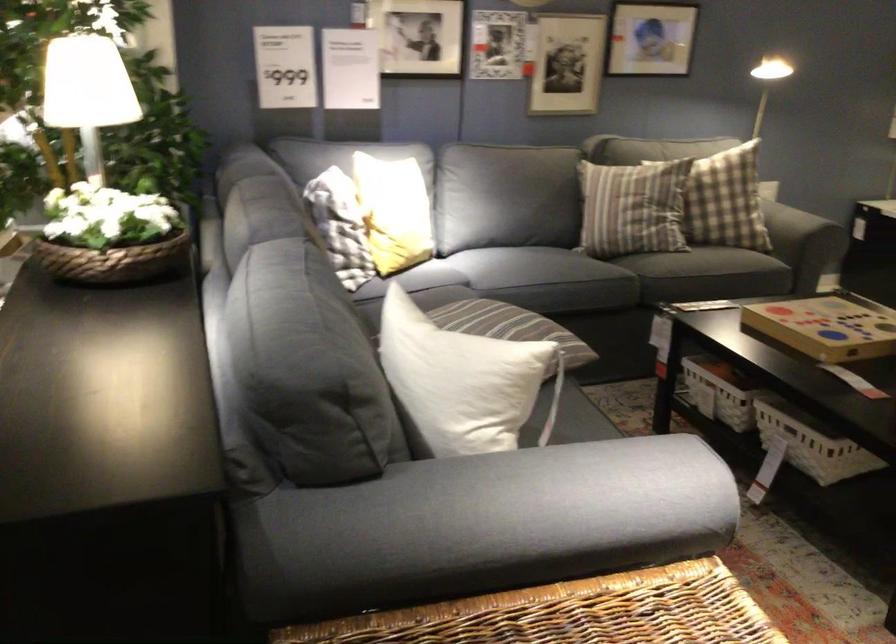
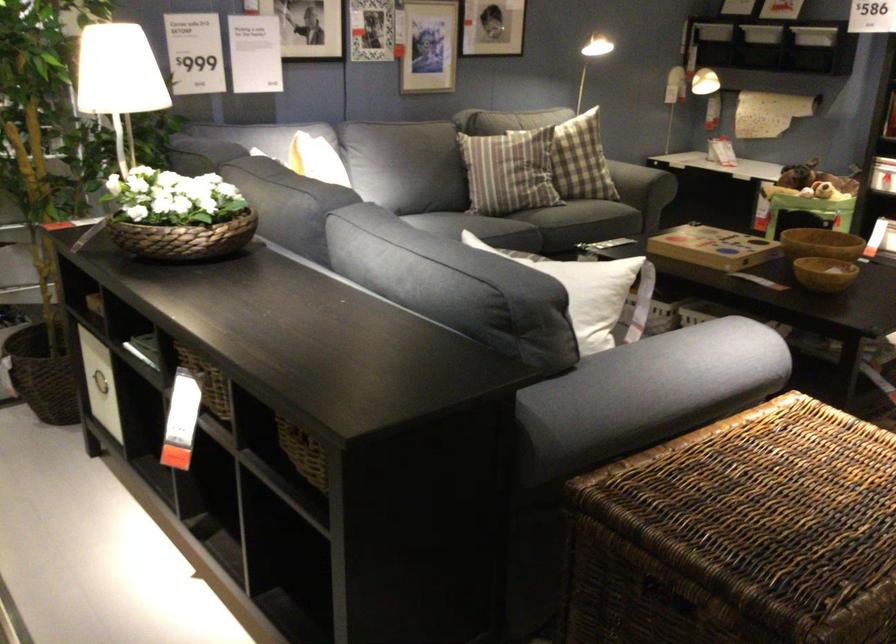
The point at (x=767, y=213) is marked in the first image. Where is the corresponding point in the second image?

(633, 180)